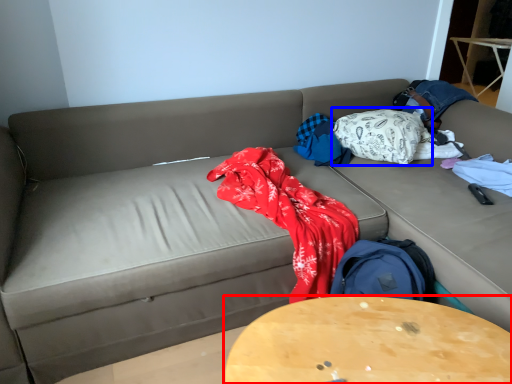
Question: Which object is further to the camera taking this photo, table (highlighted by a red box) or blanket (highlighted by a blue box)?

Choices:
 (A) table
 (B) blanket

Answer: (B)